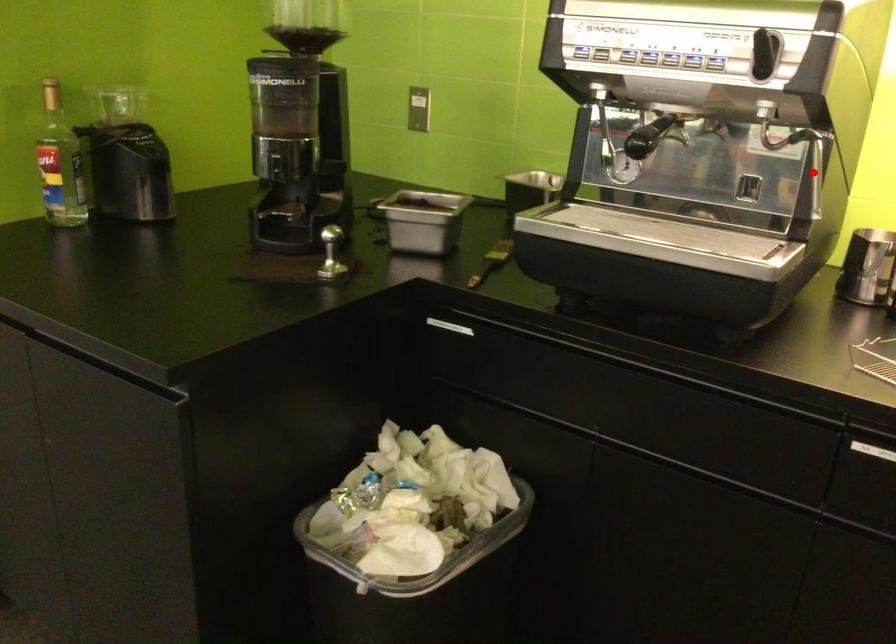
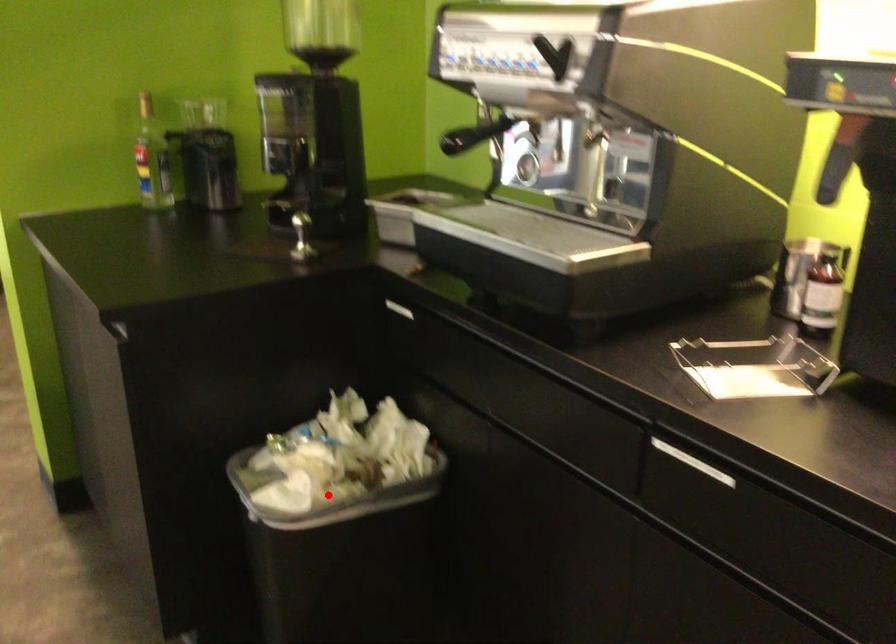
I am providing you with two images of the same scene from different viewpoints. A red point is marked on the first image and another point is marked on the second image. Is the red point in image1 aligned with the point shown in image2?

No